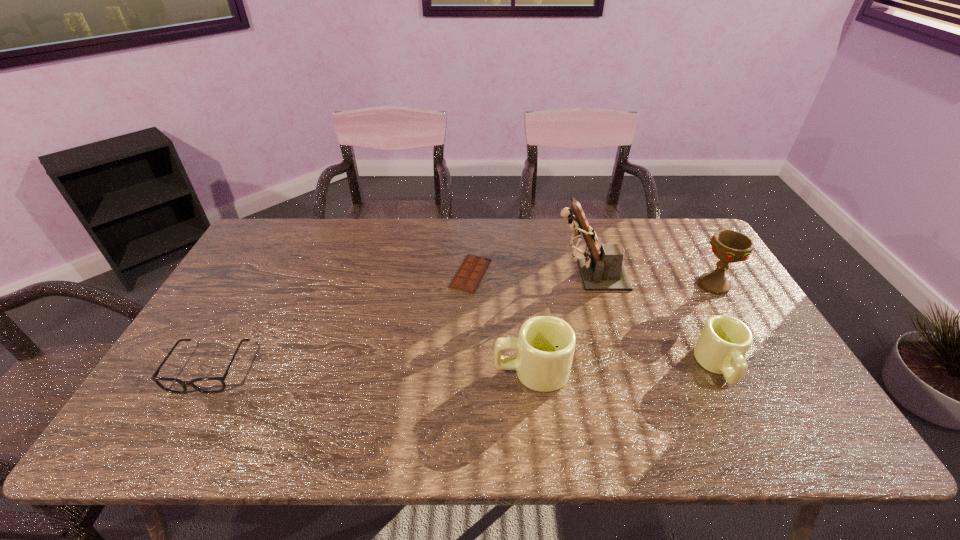
Image resolution: width=960 pixels, height=540 pixels. What are the coordinates of `vacant region at the right edge of the desktop` in the screenshot? It's located at (686, 281).

The height and width of the screenshot is (540, 960). I want to click on free spot at the far left corner of the desktop, so click(x=310, y=225).

Find the location of a particular element. vacant space at the far right corner is located at coordinates (660, 225).

You are a GUI agent. You are given a task and a screenshot of the screen. Output one action in this format:
    pyautogui.click(x=<x>, y=<y>)
    Task: Click on the free space between the leftmost object and the chalice
    
    Given the screenshot: What is the action you would take?
    pyautogui.click(x=462, y=327)

The image size is (960, 540). In order to click on free area in between the third tallest object and the second tallest object in this screenshot , I will do `click(622, 328)`.

In order to click on unoccupied area between the spectacles and the fourth shortest object in this screenshot , I will do `click(371, 370)`.

The width and height of the screenshot is (960, 540). I want to click on free space between the fourth shortest object and the leftmost object, so click(x=371, y=370).

Where is `free space between the tallest object and the shortest object`? This screenshot has height=540, width=960. free space between the tallest object and the shortest object is located at coordinates (530, 274).

Where is `free area in between the chalice and the third tallest object`? free area in between the chalice and the third tallest object is located at coordinates (622, 328).

At what (x,y) coordinates should I click in order to perform the action: click on object that is the closest to the chalice. Please return your answer as a coordinate pair (x, y). Looking at the image, I should click on (724, 341).